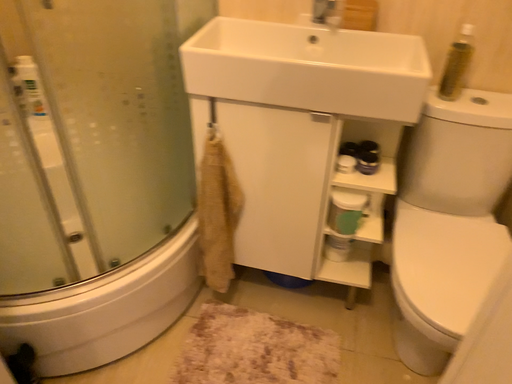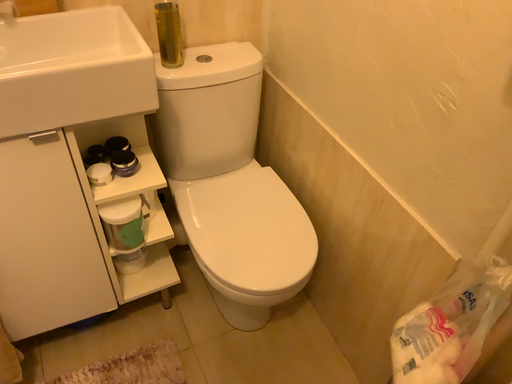
Question: How did the camera likely rotate when shooting the video?

Choices:
 (A) rotated left
 (B) rotated right

Answer: (B)